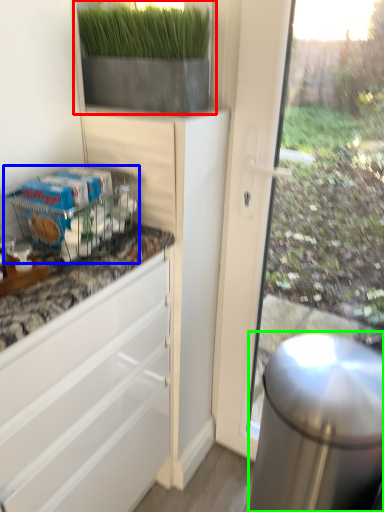
Question: Considering the real-world distances, which object is closest to houseplant (highlighted by a red box)? shelf (highlighted by a blue box) or appliance (highlighted by a green box).

Choices:
 (A) shelf
 (B) appliance

Answer: (A)